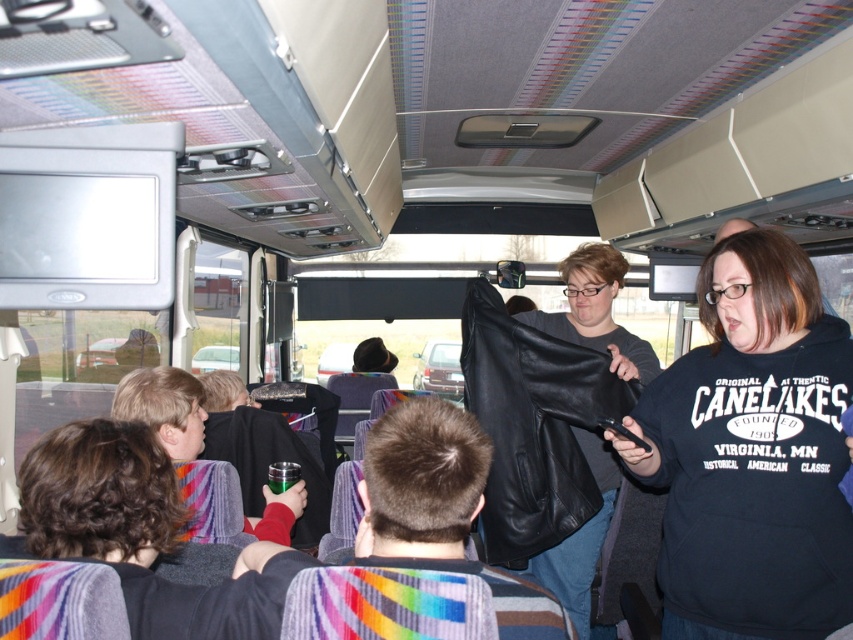
Question: Does black matte sweatshirt at center appear on the left side of black leather jacket at center?

Choices:
 (A) yes
 (B) no

Answer: (B)

Question: Which of the following is the closest to the observer?

Choices:
 (A) (817, 298)
 (B) (561, 268)

Answer: (A)

Question: Which point appears farthest from the camera in this image?

Choices:
 (A) (608, 472)
 (B) (817, 328)

Answer: (A)

Question: Is black matte sweatshirt at center thinner than black leather jacket at center?

Choices:
 (A) no
 (B) yes

Answer: (A)

Question: Does black matte sweatshirt at center have a greater width compared to black leather jacket at center?

Choices:
 (A) no
 (B) yes

Answer: (B)